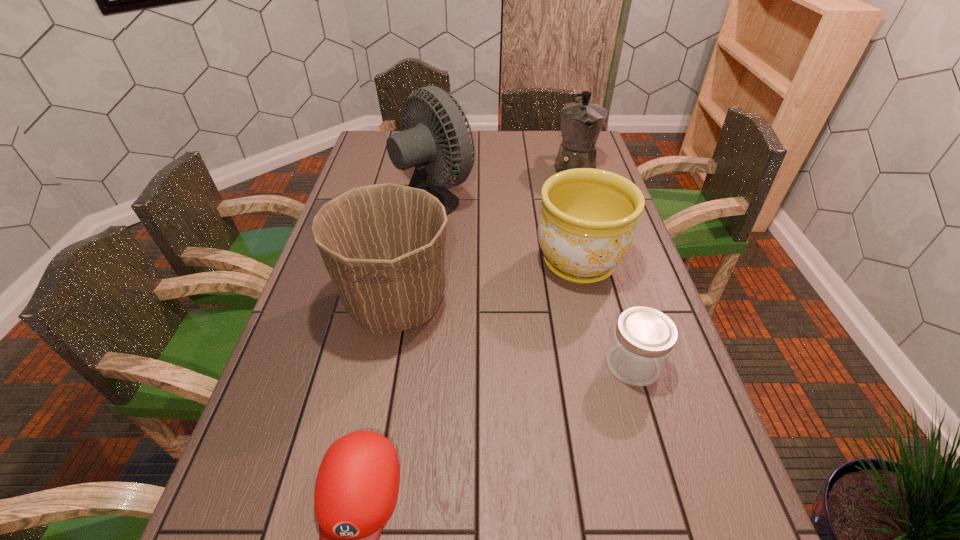
Locate an element on the screen. fan is located at coordinates (418, 146).

Locate an element on the screen. The image size is (960, 540). coffeepot is located at coordinates (581, 122).

Where is `the taller flowerpot`? This screenshot has width=960, height=540. the taller flowerpot is located at coordinates (383, 245).

This screenshot has width=960, height=540. Identify the location of the right flowerpot. (587, 224).

Locate an element on the screen. Image resolution: width=960 pixels, height=540 pixels. the third shortest object is located at coordinates (587, 224).

Locate an element on the screen. The height and width of the screenshot is (540, 960). the second shortest object is located at coordinates (643, 339).

The height and width of the screenshot is (540, 960). I want to click on vacant space located in front of the tallest object to direct airflow, so click(591, 199).

Locate an element on the screen. Image resolution: width=960 pixels, height=540 pixels. vacant area situated 0.200m on the pouring side of the coffeepot is located at coordinates (589, 219).

Where is `free spot located on the front of the taller flowerpot`? free spot located on the front of the taller flowerpot is located at coordinates (381, 386).

Where is `vacant space located on the back of the shorter flowerpot`? vacant space located on the back of the shorter flowerpot is located at coordinates (563, 196).